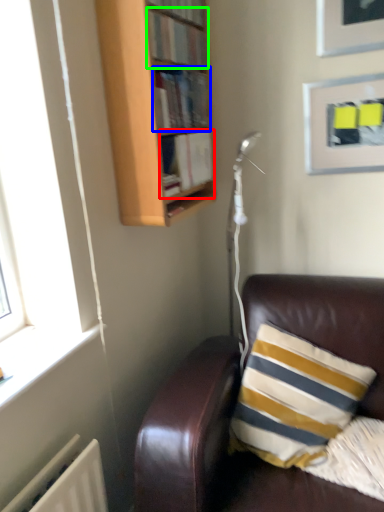
Question: Estimate the real-world distances between objects in this image. Which object is farther from book (highlighted by a red box), book (highlighted by a blue box) or book (highlighted by a green box)?

Choices:
 (A) book
 (B) book

Answer: (B)